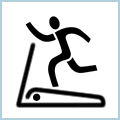
Locate an element on the screen. bold outline depiction of a treadmill is located at coordinates (42, 92).